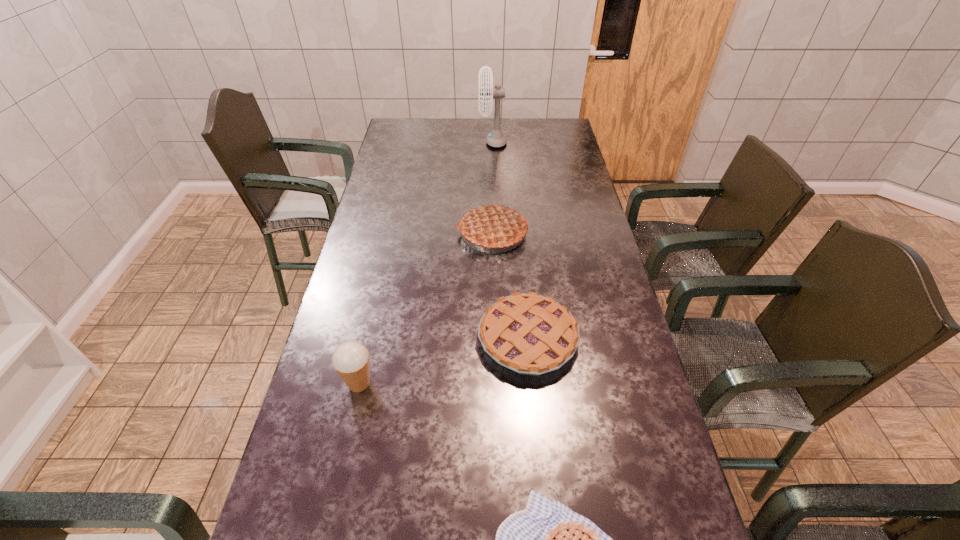
Find the location of `vacant region that satisfies the following two spatial constraints: 1. on the front-facing side of the tallest object; 2. on the front side of the second tallest object`. vacant region that satisfies the following two spatial constraints: 1. on the front-facing side of the tallest object; 2. on the front side of the second tallest object is located at coordinates (496, 233).